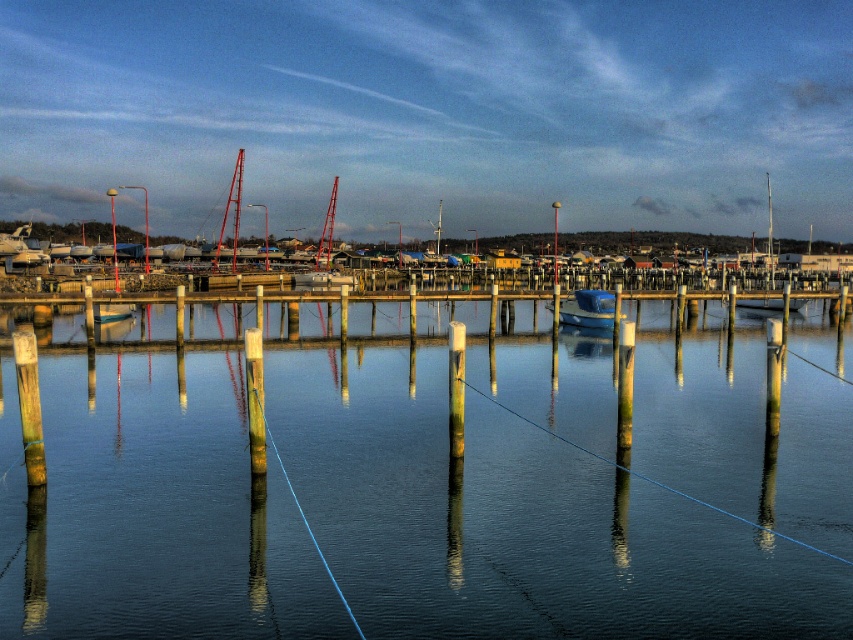
You are a photographer trying to capture the marina scene. You notice the wooden post at center and the metallic mast at center. Which object would appear taller in your photo?

The metallic mast at center is taller than the wooden post at center, so it would appear taller in the photo.

You are standing on the dock and want to place a new wooden post exactly where the point is. Is the spot at point (28, 404) suitable for placing a new wooden post?

The point (28, 404) marks a smooth wooden post at left, so placing a new wooden post there would not be suitable as the spot is already occupied by an existing post.

You are standing at the point marked as point (787, 404) in the marina scene. You want to walk to the dock entrance located at the edge of the marina. Given that your walking speed is 3 feet per second, how many seconds will it take you to reach the dock entrance?

The distance between you and the dock entrance is 69.69 feet. At a walking speed of 3 feet per second, it will take approximately 23.23 seconds to reach the dock entrance.